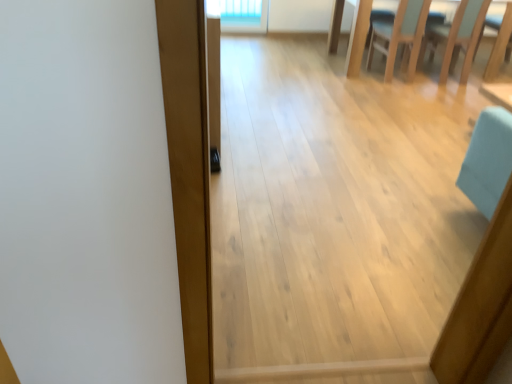
Question: Can you confirm if light blue fabric chair at upper right is bigger than light wood chair at upper right?

Choices:
 (A) yes
 (B) no

Answer: (B)

Question: From the image's perspective, does light blue fabric chair at upper right appear higher than light wood chair at upper right?

Choices:
 (A) no
 (B) yes

Answer: (B)

Question: Could you tell me if light blue fabric chair at upper right is facing light wood chair at upper right?

Choices:
 (A) no
 (B) yes

Answer: (A)

Question: From the image's perspective, is light blue fabric chair at upper right below light wood chair at upper right?

Choices:
 (A) yes
 (B) no

Answer: (B)

Question: Is light wood chair at upper right a part of light blue fabric chair at upper right?

Choices:
 (A) yes
 (B) no

Answer: (B)

Question: Visually, is light blue fabric chair at upper right positioned to the left or to the right of light wood chair at upper right?

Choices:
 (A) left
 (B) right

Answer: (B)

Question: Is point (453, 56) positioned closer to the camera than point (380, 46)?

Choices:
 (A) closer
 (B) farther

Answer: (A)

Question: From a real-world perspective, is light blue fabric chair at upper right physically located above or below light wood chair at upper right?

Choices:
 (A) below
 (B) above

Answer: (B)

Question: In the image, is light blue fabric chair at upper right positioned in front of or behind light wood chair at upper right?

Choices:
 (A) front
 (B) behind

Answer: (B)

Question: From a real-world perspective, is light brown wood plank at center positioned above or below light blue fabric chair at upper right?

Choices:
 (A) above
 (B) below

Answer: (A)

Question: In terms of width, does light brown wood plank at center look wider or thinner when compared to light blue fabric chair at upper right?

Choices:
 (A) thin
 (B) wide

Answer: (A)

Question: Considering the positions of point (187, 370) and point (449, 44), is point (187, 370) closer or farther from the camera than point (449, 44)?

Choices:
 (A) closer
 (B) farther

Answer: (A)

Question: Based on their positions, is light brown wood plank at center located to the left or right of light blue fabric chair at upper right?

Choices:
 (A) right
 (B) left

Answer: (B)

Question: Looking at their shapes, would you say light brown wood plank at center is wider or thinner than light wood chair at upper right?

Choices:
 (A) thin
 (B) wide

Answer: (A)

Question: From the image's perspective, is light brown wood plank at center above or below light wood chair at upper right?

Choices:
 (A) below
 (B) above

Answer: (A)